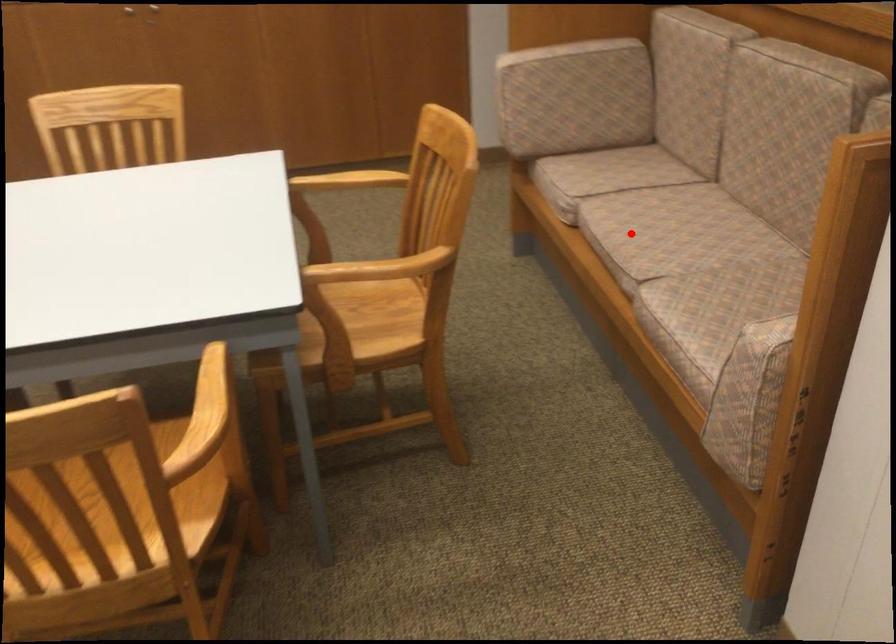
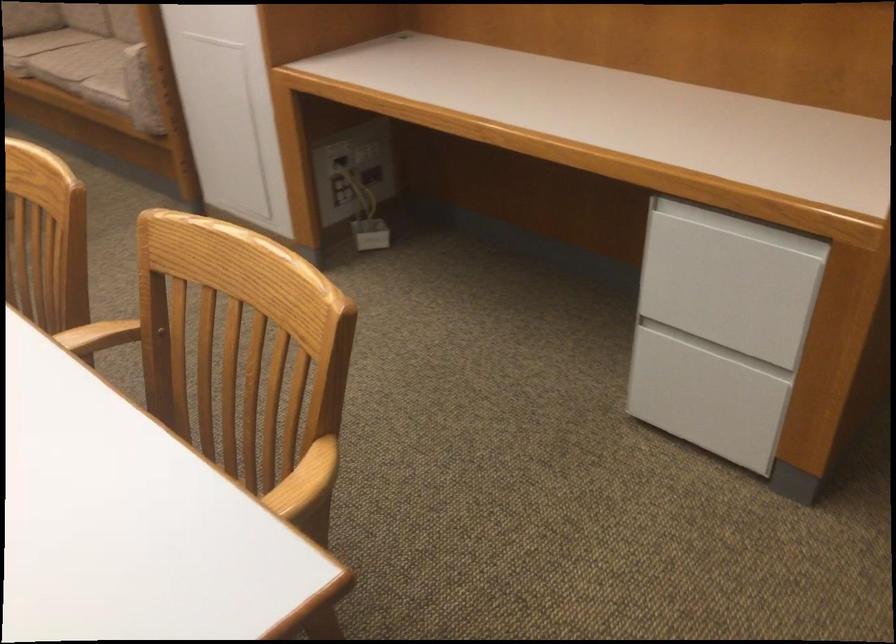
Where in the second image is the point corresponding to the highlighted location from the first image?

(76, 61)